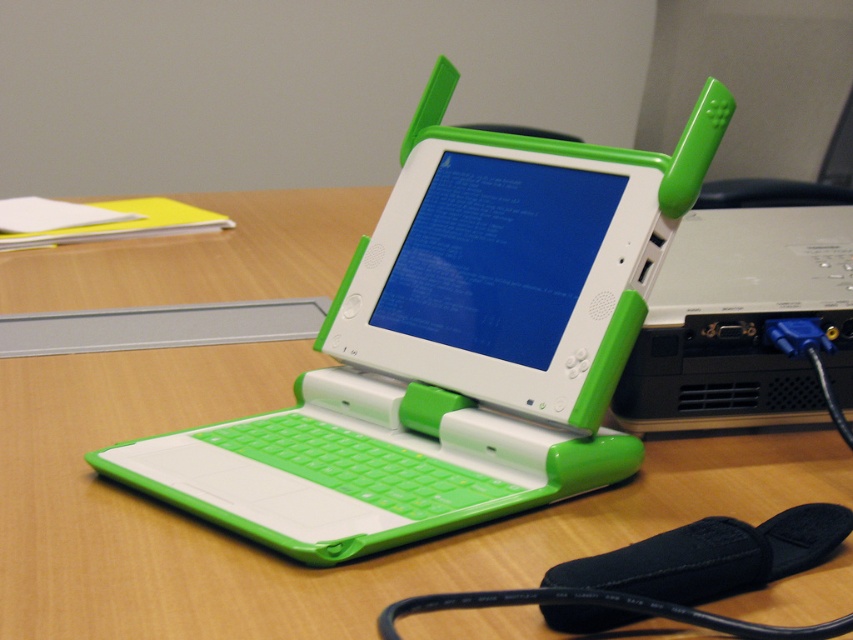
Question: Can you confirm if green matte laptop at center is positioned below white plastic computer at center?

Choices:
 (A) yes
 (B) no

Answer: (A)

Question: Which of the following is the closest to the observer?

Choices:
 (A) (447, 372)
 (B) (769, 291)

Answer: (A)

Question: Is green matte laptop at center wider than white plastic computer at center?

Choices:
 (A) yes
 (B) no

Answer: (A)

Question: Does green matte laptop at center appear under white plastic computer at center?

Choices:
 (A) no
 (B) yes

Answer: (B)

Question: Which point is closer to the camera?

Choices:
 (A) white plastic computer at center
 (B) green matte laptop at center

Answer: (B)